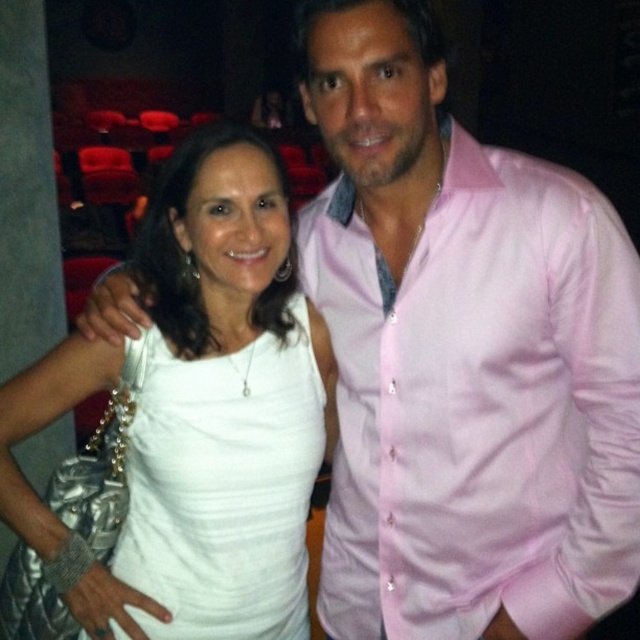
Question: Does white satin dress at center have a lesser width compared to white ribbed tank top at center?

Choices:
 (A) yes
 (B) no

Answer: (B)

Question: Which point is farther to the camera?

Choices:
 (A) (147, 253)
 (B) (145, 560)

Answer: (A)

Question: Is white satin dress at center positioned behind white ribbed tank top at center?

Choices:
 (A) yes
 (B) no

Answer: (B)

Question: Can you confirm if white satin dress at center is positioned above white ribbed tank top at center?

Choices:
 (A) no
 (B) yes

Answer: (B)